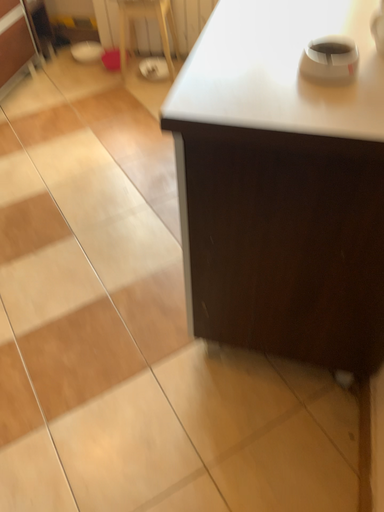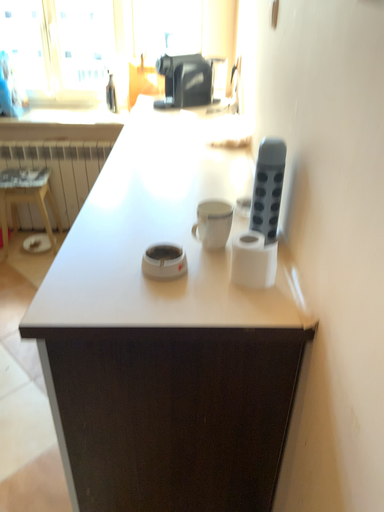
Question: Which way did the camera rotate in the video?

Choices:
 (A) rotated upward
 (B) rotated downward

Answer: (A)